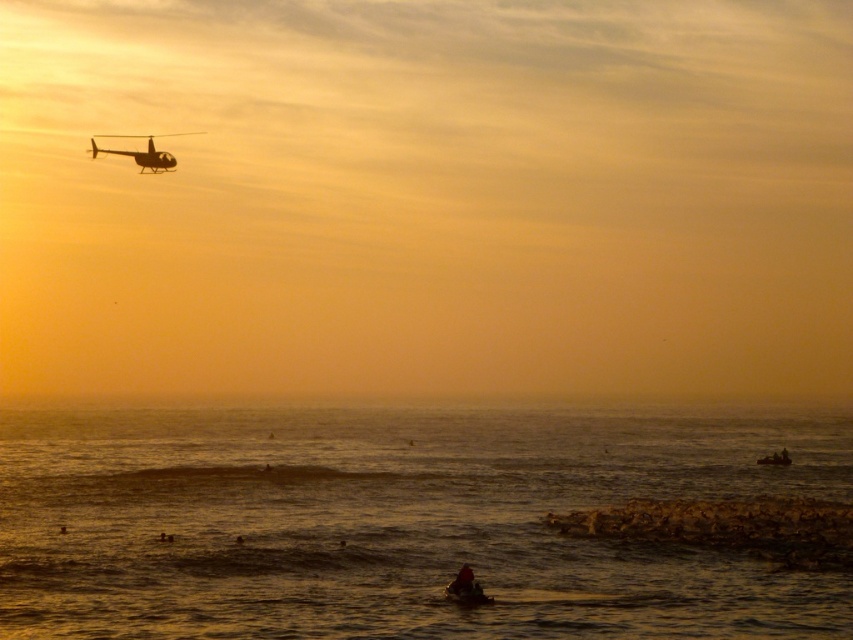
Question: Which object appears closest to the camera in this image?

Choices:
 (A) golden water at lower center
 (B) metallic silver helicopter at upper left

Answer: (A)

Question: Among these objects, which one is farthest from the camera?

Choices:
 (A) metallic silver helicopter at upper left
 (B) golden water at lower center

Answer: (A)

Question: From the image, what is the correct spatial relationship of golden water at lower center in relation to metallic silver helicopter at upper left?

Choices:
 (A) left
 (B) right

Answer: (B)

Question: From the image, what is the correct spatial relationship of golden water at lower center in relation to metallic silver helicopter at upper left?

Choices:
 (A) right
 (B) left

Answer: (A)

Question: Is golden water at lower center above metallic silver helicopter at upper left?

Choices:
 (A) yes
 (B) no

Answer: (B)